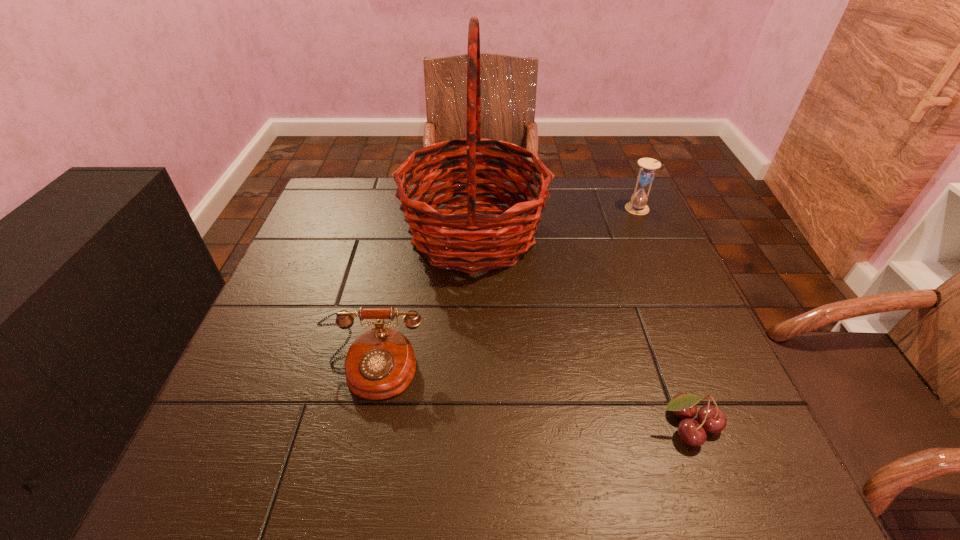
This screenshot has width=960, height=540. What are the coordinates of `vacant space at the right edge` in the screenshot? It's located at (642, 229).

In order to click on vacant space at the far left corner of the desktop in this screenshot , I will do `click(337, 190)`.

The width and height of the screenshot is (960, 540). In order to click on vacant region at the far right corner in this screenshot , I will do `click(593, 219)`.

The image size is (960, 540). I want to click on vacant point located between the basket and the cherry, so 581,330.

What are the coordinates of `free space between the nearest object and the third tallest object` in the screenshot? It's located at (530, 398).

Identify the location of free space between the hourglass and the cherry. Image resolution: width=960 pixels, height=540 pixels. (662, 318).

Identify the location of free space between the hourglass and the second nearest object. (505, 289).

Image resolution: width=960 pixels, height=540 pixels. What are the coordinates of `free area in between the third shortest object and the basket` in the screenshot? It's located at (556, 222).

I want to click on vacant area between the shortest object and the tallest object, so click(581, 330).

Image resolution: width=960 pixels, height=540 pixels. In order to click on vacant area that lies between the tallest object and the nearest object in this screenshot , I will do `click(581, 330)`.